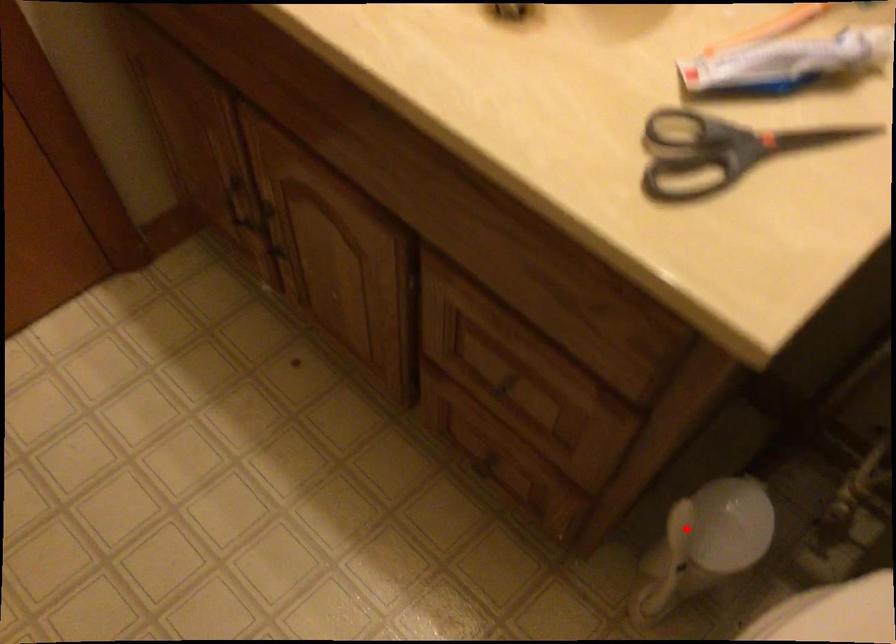
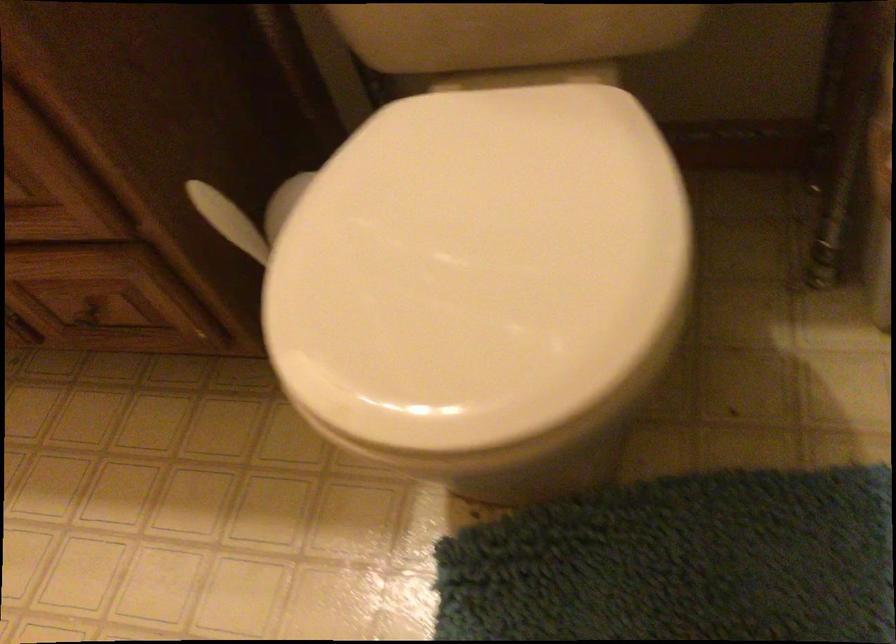
The point at the highlighted location is marked in the first image. Where is the corresponding point in the second image?

(222, 214)